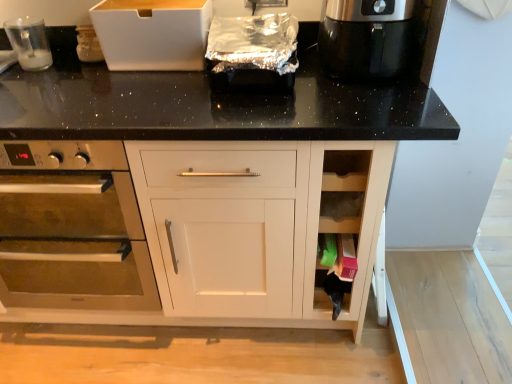
Question: Can you confirm if stainless steel oven at left is bigger than shiny black coffee maker at upper right?

Choices:
 (A) yes
 (B) no

Answer: (A)

Question: From a real-world perspective, is stainless steel oven at left beneath shiny black coffee maker at upper right?

Choices:
 (A) no
 (B) yes

Answer: (B)

Question: From the image's perspective, is stainless steel oven at left located beneath shiny black coffee maker at upper right?

Choices:
 (A) no
 (B) yes

Answer: (B)

Question: Considering the relative positions of stainless steel oven at left and shiny black coffee maker at upper right in the image provided, is stainless steel oven at left to the right of shiny black coffee maker at upper right from the viewer's perspective?

Choices:
 (A) yes
 (B) no

Answer: (B)

Question: Is stainless steel oven at left not near shiny black coffee maker at upper right?

Choices:
 (A) no
 (B) yes

Answer: (A)

Question: Does point (26, 34) appear closer or farther from the camera than point (397, 44)?

Choices:
 (A) farther
 (B) closer

Answer: (A)

Question: Is clear plastic cup at upper left wider or thinner than shiny black coffee maker at upper right?

Choices:
 (A) wide
 (B) thin

Answer: (B)

Question: From the image's perspective, is clear plastic cup at upper left located above or below shiny black coffee maker at upper right?

Choices:
 (A) below
 (B) above

Answer: (B)

Question: In terms of height, does clear plastic cup at upper left look taller or shorter compared to shiny black coffee maker at upper right?

Choices:
 (A) short
 (B) tall

Answer: (A)

Question: From a real-world perspective, is shiny black coffee maker at upper right above or below clear plastic cup at upper left?

Choices:
 (A) above
 (B) below

Answer: (A)

Question: From the image's perspective, is shiny black coffee maker at upper right positioned above or below clear plastic cup at upper left?

Choices:
 (A) below
 (B) above

Answer: (A)

Question: Is shiny black coffee maker at upper right situated inside clear plastic cup at upper left or outside?

Choices:
 (A) inside
 (B) outside

Answer: (B)

Question: Is shiny black coffee maker at upper right taller or shorter than clear plastic cup at upper left?

Choices:
 (A) short
 (B) tall

Answer: (B)

Question: Visually, is shiny black coffee maker at upper right positioned to the left or to the right of stainless steel oven at left?

Choices:
 (A) left
 (B) right

Answer: (B)

Question: From their relative heights in the image, would you say shiny black coffee maker at upper right is taller or shorter than stainless steel oven at left?

Choices:
 (A) tall
 (B) short

Answer: (B)